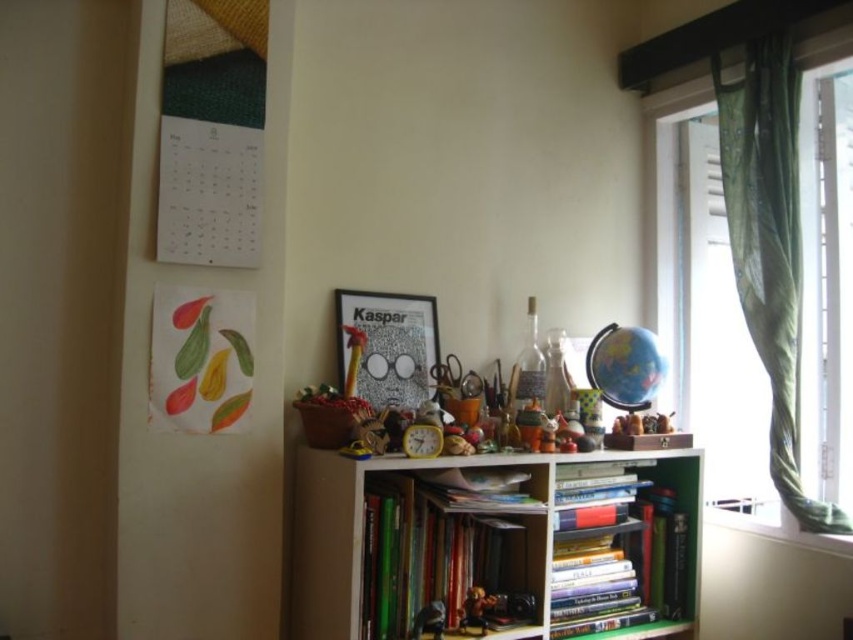
You are standing in the study and want to reach the hardcover books at center on the bookshelf. If your arm can extend 1.5 meters, can you comfortably reach them without moving closer?

The hardcover books at center are 1.68 meters away from the viewer. Since your arm can only extend 1.5 meters, you cannot comfortably reach them without moving closer.

You are organizing a shelf and need to know which object is taller between the matte paper picture frame at center and the metallic gold figurine at center. Which one is taller?

The matte paper picture frame at center is taller than the metallic gold figurine at center.